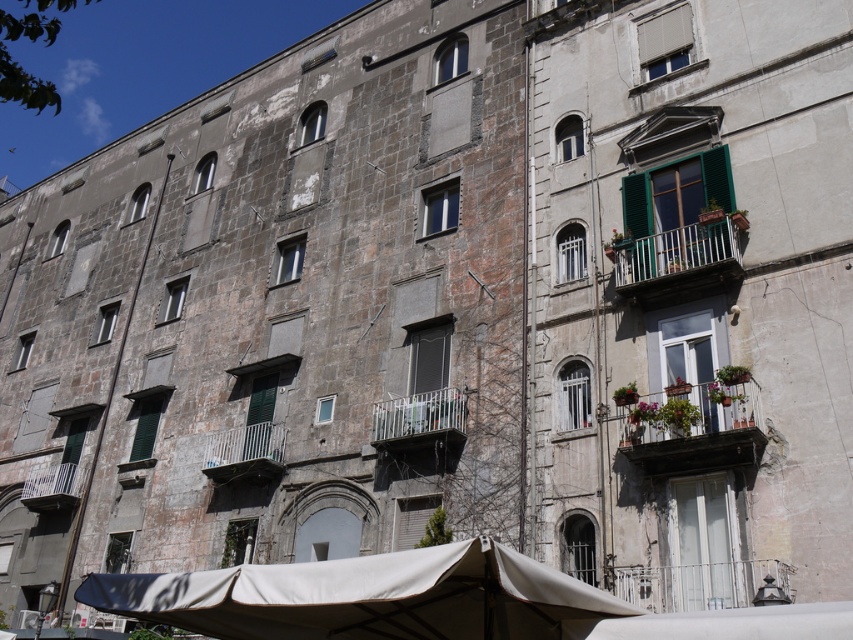
Question: Which point appears closest to the camera in this image?

Choices:
 (A) (618, 285)
 (B) (260, 426)
 (C) (24, 502)
 (D) (430, 429)

Answer: (A)

Question: Does white metal balcony at upper right have a smaller size compared to white metal balcony at center?

Choices:
 (A) yes
 (B) no

Answer: (B)

Question: From the image, what is the correct spatial relationship of white painted wood balcony at right in relation to metallic silver balcony at center?

Choices:
 (A) below
 (B) above

Answer: (B)

Question: Which point is farther to the camera?

Choices:
 (A) (412, 627)
 (B) (405, 410)

Answer: (B)

Question: Does white painted wood balcony at right have a lesser width compared to metallic silver balcony at center?

Choices:
 (A) no
 (B) yes

Answer: (B)

Question: Estimate the real-world distances between objects in this image. Which object is closer to the beige fabric canopy at lower center?

Choices:
 (A) white painted wood balcony at right
 (B) white metal balcony at lower left
 (C) white metal balcony at center

Answer: (A)